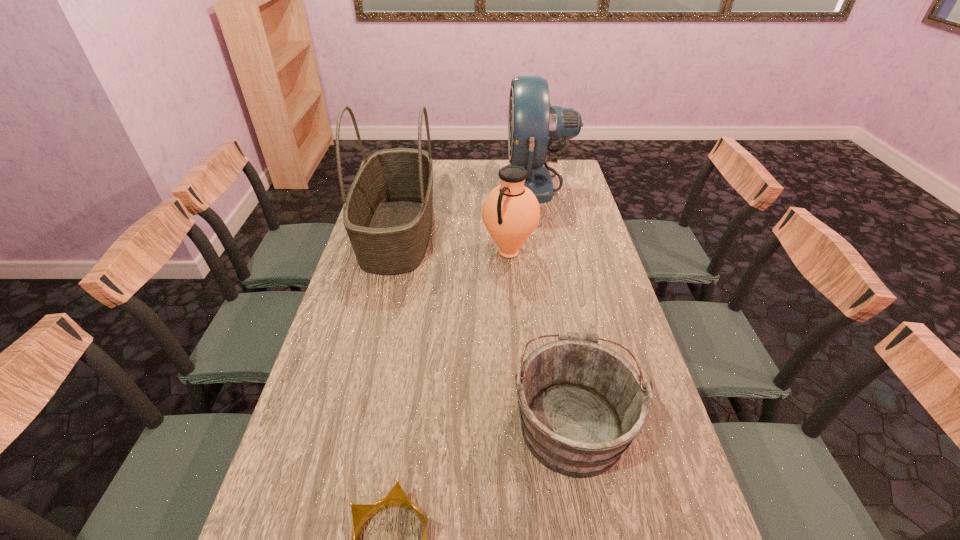
What are the coordinates of `fan` in the screenshot? It's located at (533, 124).

Find the location of a particular element. basket is located at coordinates (388, 212).

The image size is (960, 540). I want to click on pitcher, so (510, 212).

This screenshot has width=960, height=540. What are the coordinates of `the fourth farthest object` in the screenshot? It's located at (581, 404).

You are a GUI agent. You are given a task and a screenshot of the screen. Output one action in this format:
    pyautogui.click(x=<x>, y=<y>)
    Task: Click on the second shortest object
    The height and width of the screenshot is (540, 960).
    Given the screenshot: What is the action you would take?
    pyautogui.click(x=581, y=404)

Identify the location of free spot located in front of the fan to blow air. The width and height of the screenshot is (960, 540). (420, 184).

The height and width of the screenshot is (540, 960). I want to click on vacant position located in front of the fan to blow air, so click(468, 184).

Where is `vacant space located 0.310m in front of the fan to blow air`? vacant space located 0.310m in front of the fan to blow air is located at coordinates (429, 184).

Locate an element on the screen. blank area located 0.080m on the right of the basket is located at coordinates (457, 231).

Locate an element on the screen. The height and width of the screenshot is (540, 960). free location located on the front of the pitcher is located at coordinates (513, 296).